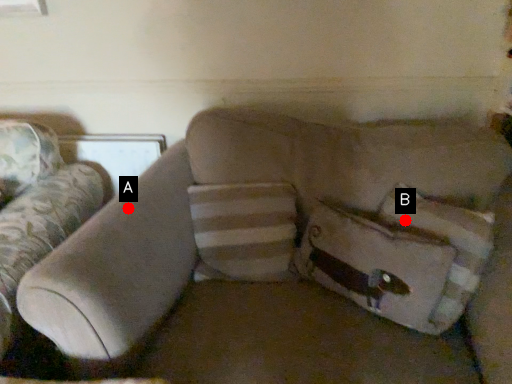
Question: Two points are circled on the image, labeled by A and B beside each circle. Which point is closer to the camera?

Choices:
 (A) A is closer
 (B) B is closer

Answer: (A)